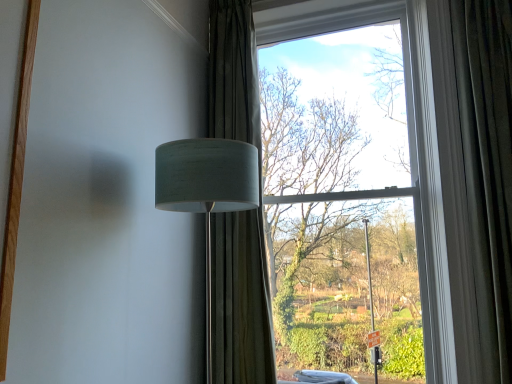
Question: Does white fabric lampshade at left have a smaller size compared to velvet dark green curtain at right, which is the first curtain from right to left?

Choices:
 (A) yes
 (B) no

Answer: (B)

Question: Is white fabric lampshade at left not near velvet dark green curtain at right, which appears as the 2th curtain when viewed from the left?

Choices:
 (A) yes
 (B) no

Answer: (A)

Question: Considering the relative sizes of white fabric lampshade at left and velvet dark green curtain at right, which is the first curtain from right to left, in the image provided, is white fabric lampshade at left shorter than velvet dark green curtain at right, which is the first curtain from right to left,?

Choices:
 (A) no
 (B) yes

Answer: (B)

Question: Is white fabric lampshade at left closer to camera compared to velvet dark green curtain at right, which appears as the 2th curtain when viewed from the left?

Choices:
 (A) no
 (B) yes

Answer: (B)

Question: Can you confirm if white fabric lampshade at left is wider than velvet dark green curtain at right, which appears as the 2th curtain when viewed from the left?

Choices:
 (A) yes
 (B) no

Answer: (A)

Question: From the image's perspective, would you say white fabric lampshade at left is positioned over velvet dark green curtain at right, which appears as the 2th curtain when viewed from the left?

Choices:
 (A) yes
 (B) no

Answer: (B)

Question: From the image's perspective, is clear glass window at center under velvet dark green curtain at right, which appears as the 2th curtain when viewed from the left?

Choices:
 (A) no
 (B) yes

Answer: (B)

Question: Is clear glass window at center shorter than velvet dark green curtain at right, which appears as the 2th curtain when viewed from the left?

Choices:
 (A) yes
 (B) no

Answer: (B)

Question: Is clear glass window at center not inside velvet dark green curtain at right, which is the first curtain from right to left?

Choices:
 (A) yes
 (B) no

Answer: (A)

Question: Can you see clear glass window at center touching velvet dark green curtain at right, which is the first curtain from right to left?

Choices:
 (A) yes
 (B) no

Answer: (B)

Question: From the image's perspective, is clear glass window at center located above velvet dark green curtain at right, which appears as the 2th curtain when viewed from the left?

Choices:
 (A) no
 (B) yes

Answer: (A)

Question: Can you confirm if clear glass window at center is positioned to the right of velvet dark green curtain at right, which is the first curtain from right to left?

Choices:
 (A) yes
 (B) no

Answer: (B)

Question: From the image's perspective, is velvet dark green curtain at right, which appears as the 2th curtain when viewed from the left, below white fabric lampshade at left?

Choices:
 (A) yes
 (B) no

Answer: (B)